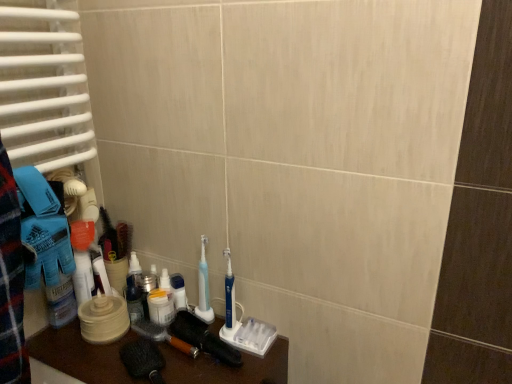
The height and width of the screenshot is (384, 512). What are the coordinates of `free space above white plastic toothbrushes at lower left (from a real-world perspective)` in the screenshot? It's located at (165, 356).